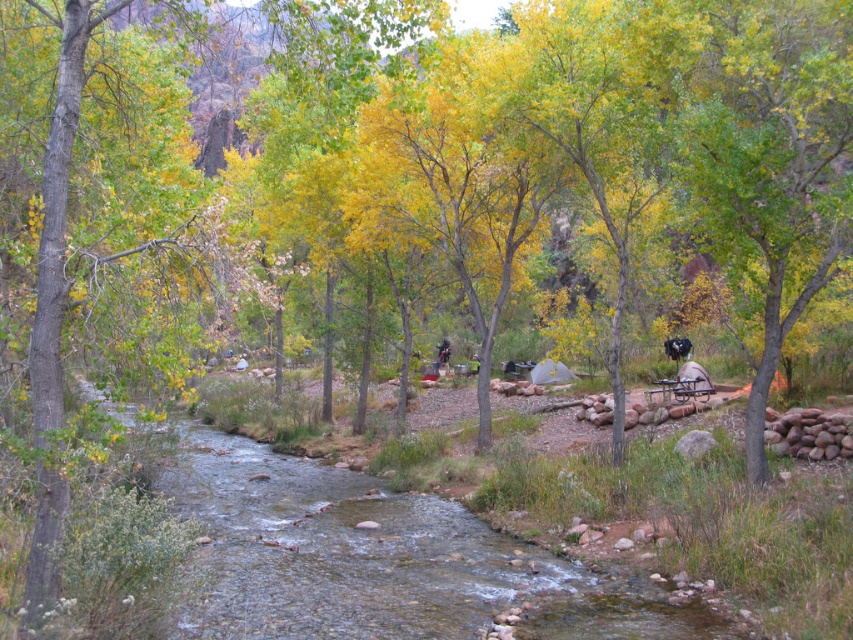
You are a hiker who wants to cross the clear water stream at center to reach your camping gear stored at the dark blue jeans at center. Given that the stream is 76.45 feet away from the jeans, can you safely walk directly from the stream to the jeans without getting wet?

The clear water stream at center is 76.45 feet away from the dark blue jeans at center, so you can safely walk directly from the stream to the jeans without getting wet as the distance is sufficient to avoid the water.

You are a hiker who wants to cross the clear water stream at center. Your backpack has a 10 meter long rope. If you tie the rope to a tree on the left bank, will you be able to reach the right bank?

The clear water stream at center and viewer are 8.03 meters apart from each other. Since the rope is 10 meters long, which is longer than the stream width, you can reach the right bank by tying the rope to the left bank tree.

You are a hiker who wants to cross the clear water stream at center while wearing the dark blue jeans at center. Since the stream is flowing, will your jeans get wet up to your knees?

The clear water stream at center is wider than the dark blue jeans at center, so yes, the stream is wider than the jeans, meaning the water will reach above the knees, leading to the jeans getting wet up to that point.